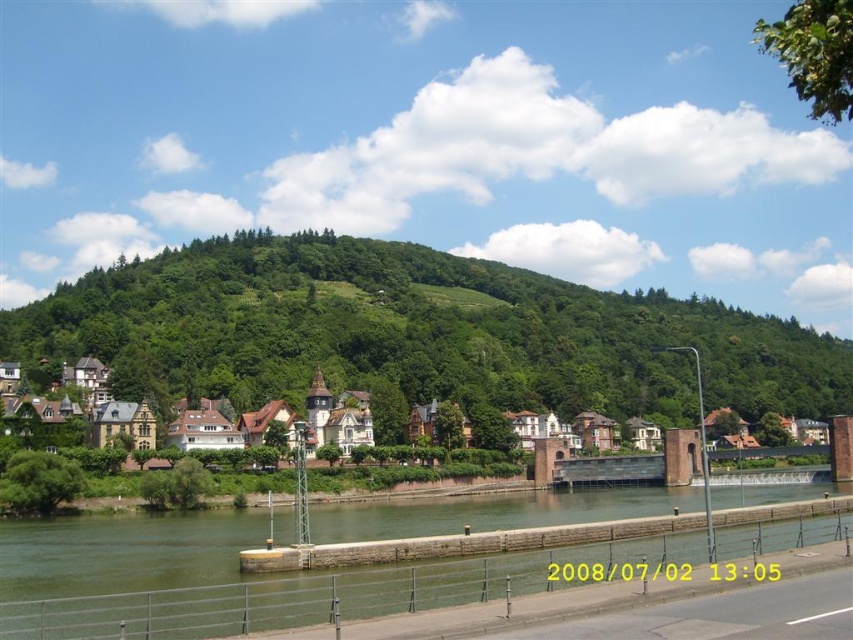
Which is more to the right, green leafy hillside at center or white wooden houses at left?

green leafy hillside at center

Which of these two, green leafy hillside at center or white wooden houses at left, stands taller?

Standing taller between the two is green leafy hillside at center.

Identify the location of green leafy hillside at center. [418, 332].

You are a GUI agent. You are given a task and a screenshot of the screen. Output one action in this format:
    pyautogui.click(x=<x>, y=<y>)
    Task: Click on the green leafy hillside at center
    The height and width of the screenshot is (640, 853).
    Given the screenshot: What is the action you would take?
    pyautogui.click(x=418, y=332)

Between green leafy hillside at center and green concrete river at lower center, which one has less height?

Standing shorter between the two is green concrete river at lower center.

Which is more to the left, green leafy hillside at center or green concrete river at lower center?

green concrete river at lower center is more to the left.

The height and width of the screenshot is (640, 853). What do you see at coordinates (418, 332) in the screenshot?
I see `green leafy hillside at center` at bounding box center [418, 332].

Locate an element on the screen. The width and height of the screenshot is (853, 640). green leafy hillside at center is located at coordinates (418, 332).

Can you confirm if green concrete river at lower center is bigger than white wooden houses at left?

Incorrect, green concrete river at lower center is not larger than white wooden houses at left.

Is green concrete river at lower center positioned before white wooden houses at left?

Yes, green concrete river at lower center is in front of white wooden houses at left.

Which is in front, point (100, 544) or point (16, 404)?

Point (100, 544) is more forward.

Where is `green concrete river at lower center`? The width and height of the screenshot is (853, 640). green concrete river at lower center is located at coordinates (247, 579).